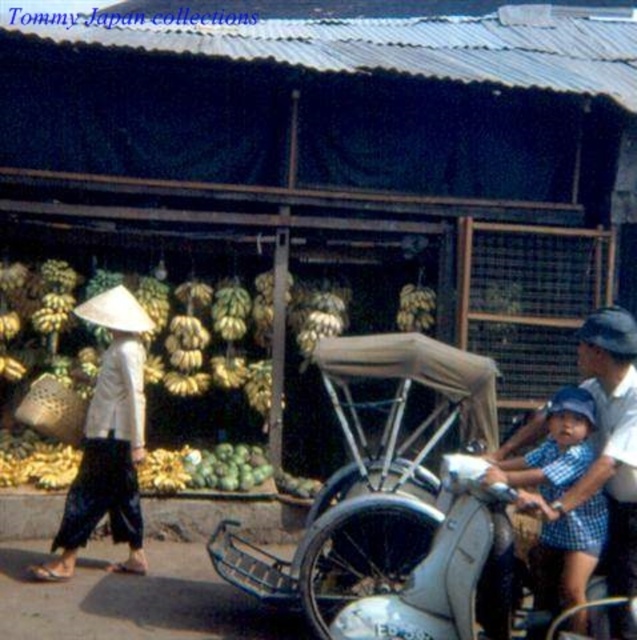
Question: Which point is closer to the camera taking this photo?

Choices:
 (A) (118, 467)
 (B) (594, 524)

Answer: (B)

Question: Does white matte conical hat at left have a larger size compared to blue checkered dress at center?

Choices:
 (A) no
 (B) yes

Answer: (B)

Question: Is white matte conical hat at left below blue checkered dress at center?

Choices:
 (A) no
 (B) yes

Answer: (A)

Question: Is white matte conical hat at left smaller than blue checkered dress at center?

Choices:
 (A) no
 (B) yes

Answer: (A)